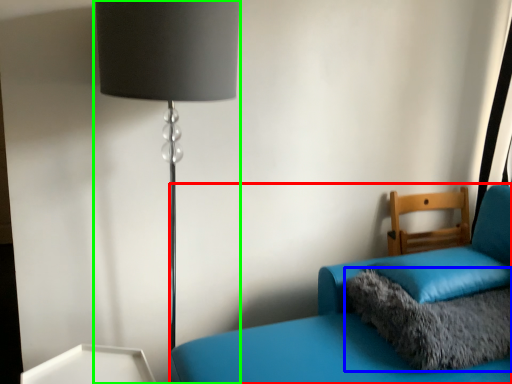
Question: Considering the real-world distances, which object is farthest from furniture (highlighted by a red box)? pillow (highlighted by a blue box) or lamp (highlighted by a green box)?

Choices:
 (A) pillow
 (B) lamp

Answer: (B)